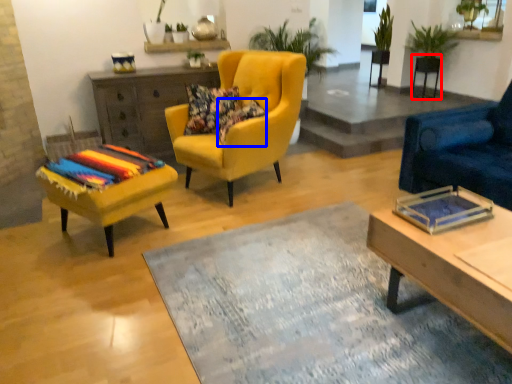
Question: Which object is further to the camera taking this photo, side table (highlighted by a red box) or pillow (highlighted by a blue box)?

Choices:
 (A) side table
 (B) pillow

Answer: (A)